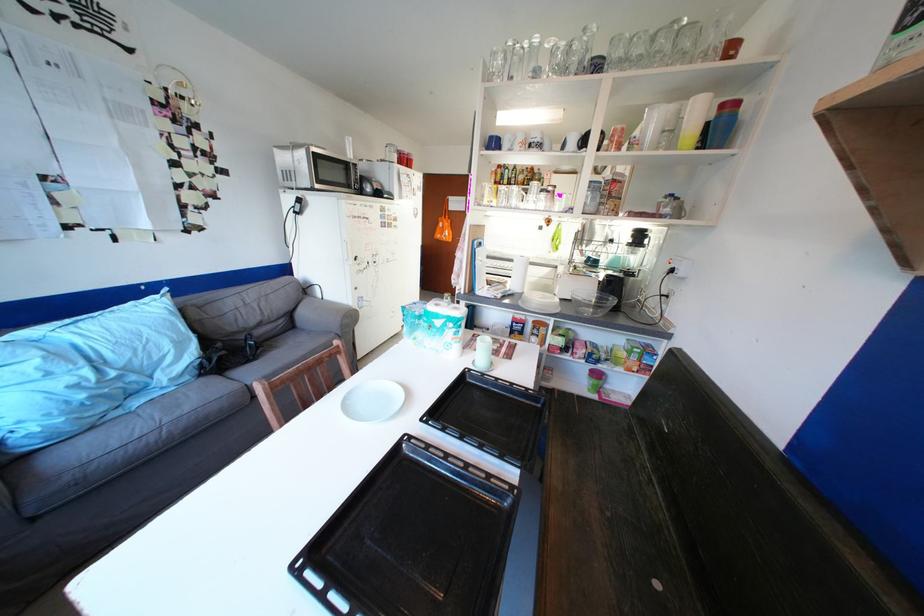
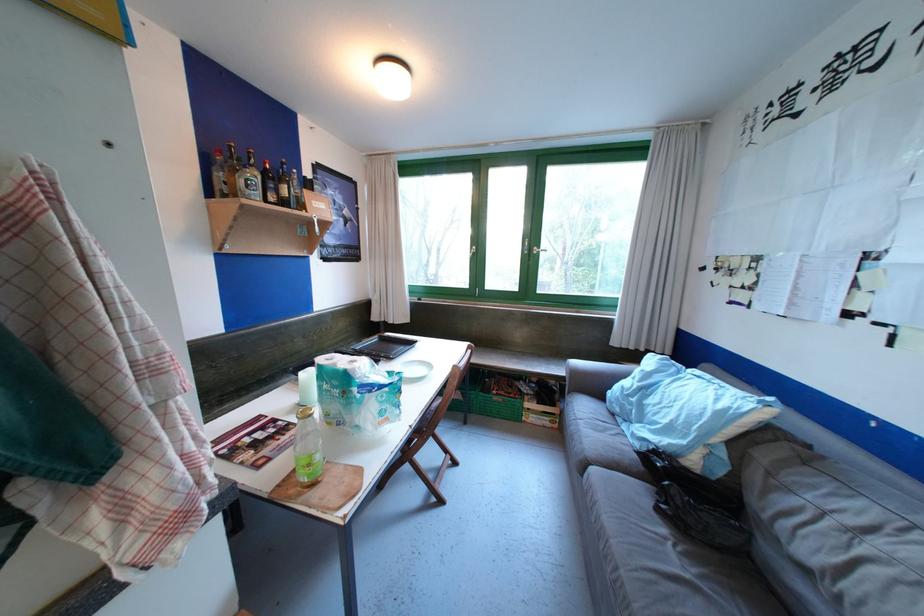
Locate, in the second image, the point that corresponds to point (186, 334) in the first image.

(697, 426)